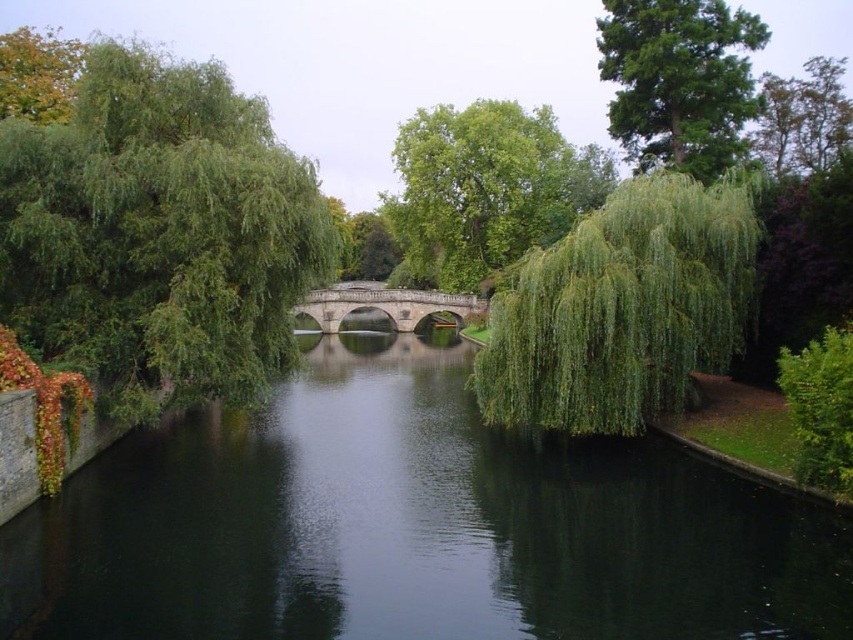
Question: Is green smooth water at center smaller than green leafy willow at center?

Choices:
 (A) yes
 (B) no

Answer: (A)

Question: Which of these objects is positioned closest to the green leafy tree at upper left?

Choices:
 (A) green leafy tree at left
 (B) green leafy tree at upper right
 (C) green smooth water at center
 (D) green leafy tree at center

Answer: (A)

Question: Which point is farther from the camera taking this photo?

Choices:
 (A) (331, 323)
 (B) (717, 74)
 (C) (549, 396)
 (D) (579, 451)

Answer: (A)

Question: In this image, where is green leafy willow at center located relative to green leafy tree at upper left?

Choices:
 (A) below
 (B) above

Answer: (A)

Question: Can you confirm if green leafy tree at center is positioned to the left of green leafy tree at upper left?

Choices:
 (A) no
 (B) yes

Answer: (A)

Question: Which is nearer to the green leafy tree at center?

Choices:
 (A) green leafy tree at upper left
 (B) stone bridge at center
 (C) green smooth water at center
 (D) green leafy willow at center

Answer: (B)